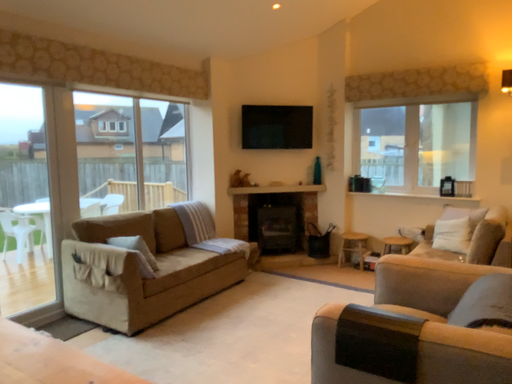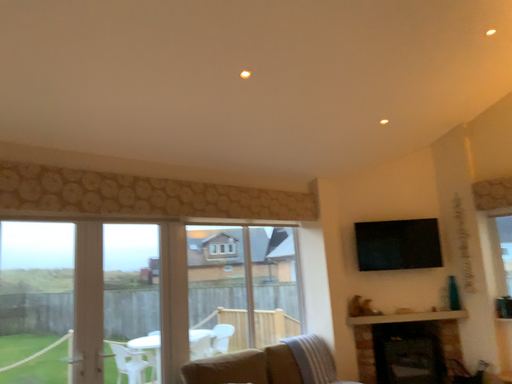
Question: Which way did the camera rotate in the video?

Choices:
 (A) rotated right
 (B) rotated left

Answer: (B)